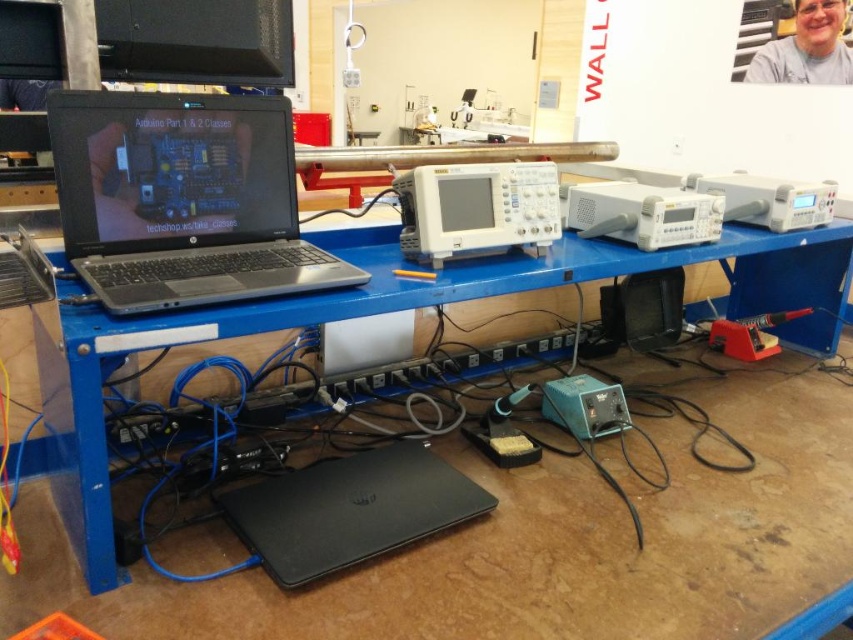
How much distance is there between matte black laptop at left and gray t-shirt at upper right?

A distance of 11.94 feet exists between matte black laptop at left and gray t-shirt at upper right.

What do you see at coordinates (183, 198) in the screenshot?
I see `matte black laptop at left` at bounding box center [183, 198].

The width and height of the screenshot is (853, 640). Describe the element at coordinates (183, 198) in the screenshot. I see `matte black laptop at left` at that location.

The width and height of the screenshot is (853, 640). What are the coordinates of `matte black laptop at left` in the screenshot? It's located at (183, 198).

Which of these two, gray t-shirt at upper right or red plastic soldering iron at lower right, stands taller?

With more height is gray t-shirt at upper right.

Which is in front, point (753, 72) or point (741, 320)?

Point (741, 320) is in front.

I want to click on gray t-shirt at upper right, so click(805, 49).

Can you confirm if white plastic oscilloscope at center is positioned below gray t-shirt at upper right?

Yes, white plastic oscilloscope at center is below gray t-shirt at upper right.

Does point (463, 211) lie behind point (819, 35)?

No, (463, 211) is in front of (819, 35).

Locate an element on the screen. white plastic oscilloscope at center is located at coordinates pos(476,209).